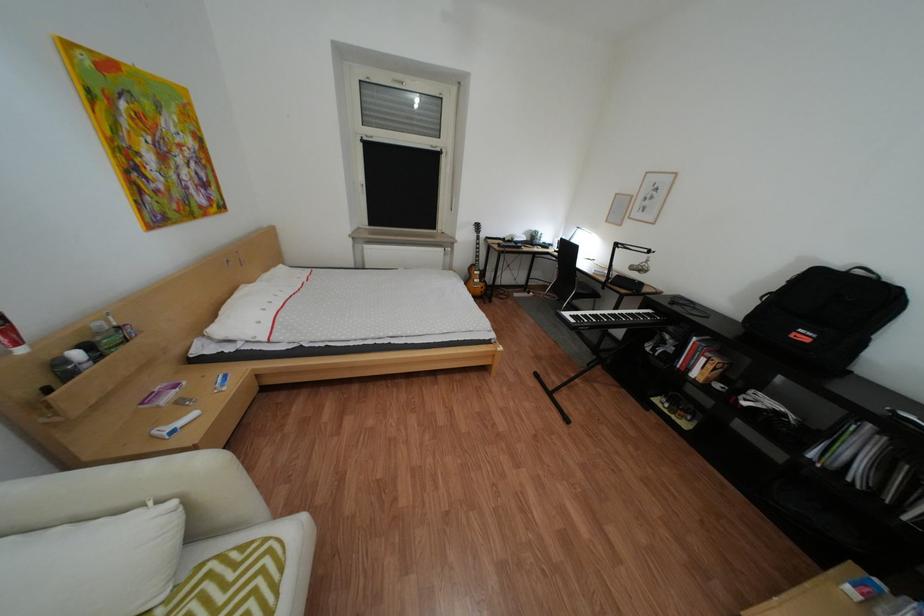
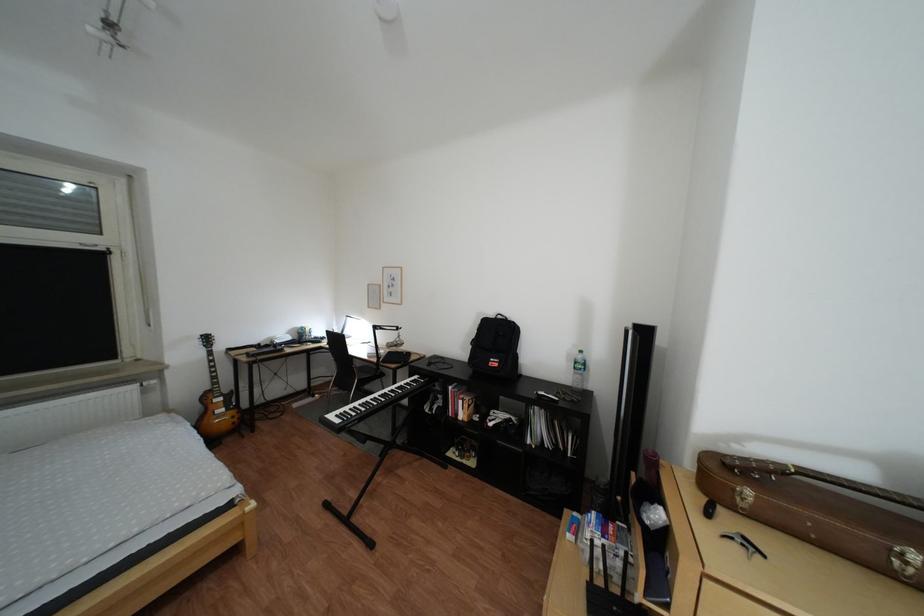
The point at (488,229) is marked in the first image. Where is the corresponding point in the second image?

(213, 344)